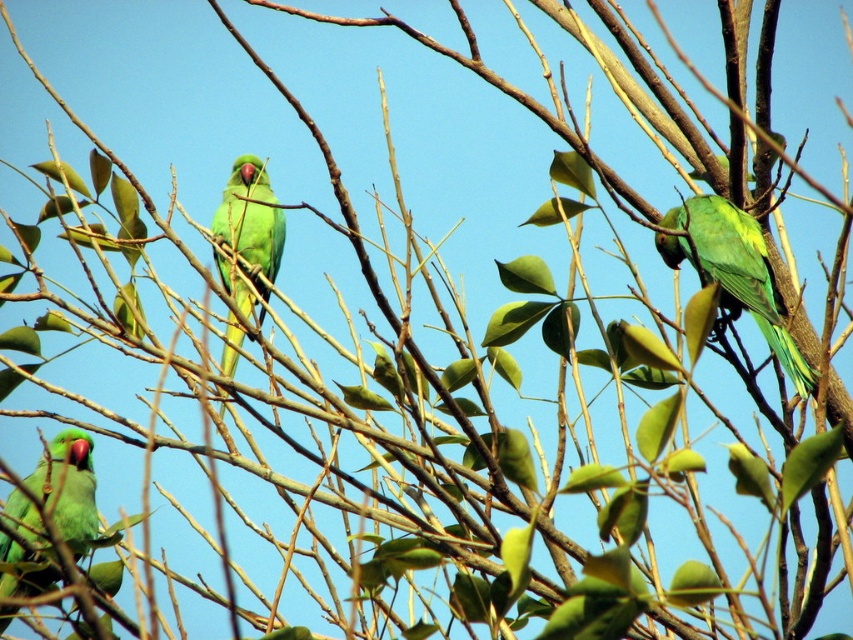
You are standing in front of the tree with three parrots. You notice two points marked on the image at coordinates point (770,284) and point (74,476). Which point is closer to you?

Point (770,284) is in front of point (74,476), so it is closer to you.

You are a birdwatcher trying to identify the parrots in the scene. You notice two parrots, the green matte parrot at upper right and the matte green parrot at lower left. Which of these two parrots is wider?

The green matte parrot at upper right is wider than the matte green parrot at lower left.

You are an ornithologist studying the positioning of parrots in a tree. You have a map of the tree branches with coordinates. Where is the green matte parrot at upper right located on the 2D coordinate system?

The green matte parrot at upper right is located at the 2D coordinate point of (733,273).